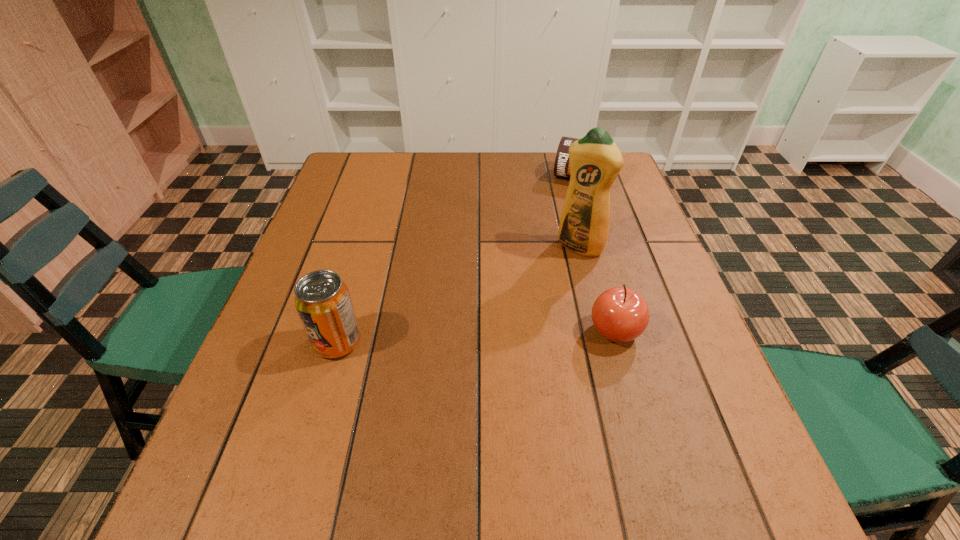
This screenshot has width=960, height=540. I want to click on vacant space located 0.400m on the front label of the farthest object, so click(x=539, y=280).

This screenshot has height=540, width=960. In order to click on vacant space located on the label of the tallest object in this screenshot , I will do `click(514, 336)`.

Where is `free location located 0.230m on the label of the tallest object`? Image resolution: width=960 pixels, height=540 pixels. free location located 0.230m on the label of the tallest object is located at coordinates (527, 317).

The image size is (960, 540). In order to click on vacant space located on the label of the tallest object in this screenshot , I will do `click(518, 329)`.

At what (x,y) coordinates should I click in order to perform the action: click on object located in the far edge section of the desktop. Please return your answer as a coordinate pair (x, y). This screenshot has height=540, width=960. Looking at the image, I should click on (561, 166).

The image size is (960, 540). In order to click on object located at the left edge in this screenshot , I will do `click(322, 300)`.

This screenshot has width=960, height=540. What are the coordinates of `apple that is at the right edge` in the screenshot? It's located at (619, 314).

Find the location of a particular element. The image size is (960, 540). can that is at the right edge is located at coordinates (561, 166).

Locate an element on the screen. The width and height of the screenshot is (960, 540). detergent positioned at the right edge is located at coordinates (595, 161).

The width and height of the screenshot is (960, 540). Find the location of `object situated at the far right corner`. object situated at the far right corner is located at coordinates (561, 166).